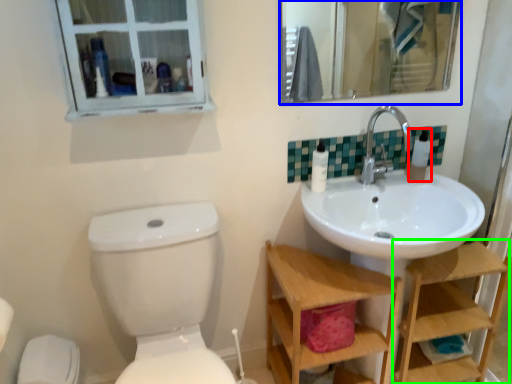
Question: Which object is positioned farthest from toiletry (highlighted by a red box)? Select from mirror (highlighted by a blue box) and shelf (highlighted by a green box).

Choices:
 (A) mirror
 (B) shelf

Answer: (A)